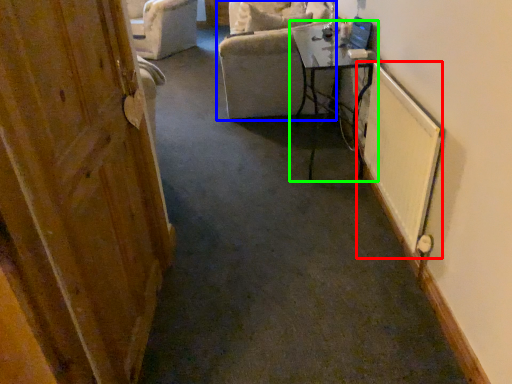
Question: Which object is positioned farthest from radiator (highlighted by a red box)? Select from chair (highlighted by a blue box) and table (highlighted by a green box).

Choices:
 (A) chair
 (B) table

Answer: (A)